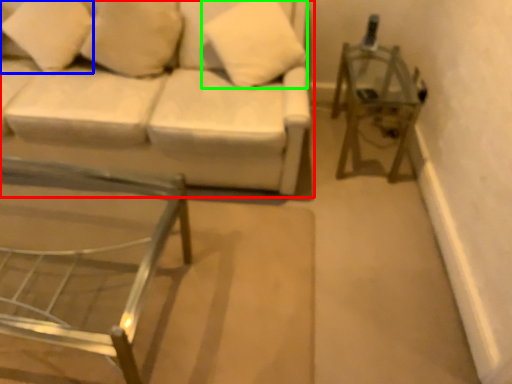
Question: Estimate the real-world distances between objects in this image. Which object is farther from studio couch (highlighted by a red box), pillow (highlighted by a blue box) or pillow (highlighted by a green box)?

Choices:
 (A) pillow
 (B) pillow

Answer: (A)